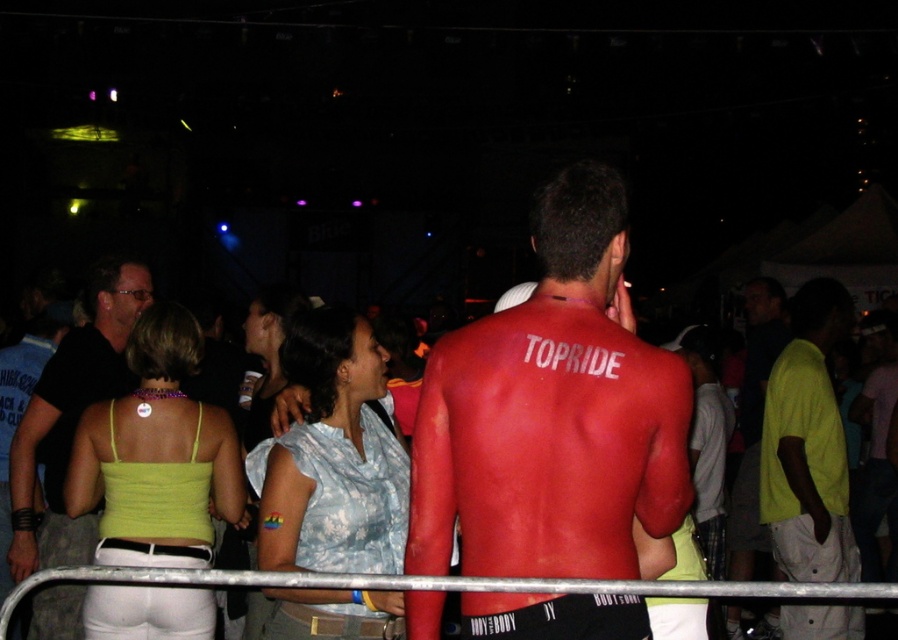
Question: Which is nearer to the matte yellow shirt at center?

Choices:
 (A) metal at lower center
 (B) matte black shirt at upper left

Answer: (A)

Question: Which object appears closest to the camera in this image?

Choices:
 (A) matte red body paint at center
 (B) matte yellow shirt at center
 (C) matte black shirt at upper left
 (D) metal at lower center

Answer: (D)

Question: Can you confirm if matte black shirt at upper left is positioned above metal at lower center?

Choices:
 (A) yes
 (B) no

Answer: (A)

Question: Which object is positioned closest to the metal at lower center?

Choices:
 (A) matte red body paint at center
 (B) matte black shirt at upper left
 (C) matte yellow shirt at center

Answer: (A)

Question: Is matte red body paint at center wider than metal at lower center?

Choices:
 (A) no
 (B) yes

Answer: (A)

Question: Is matte red body paint at center positioned in front of matte yellow shirt at center?

Choices:
 (A) no
 (B) yes

Answer: (B)